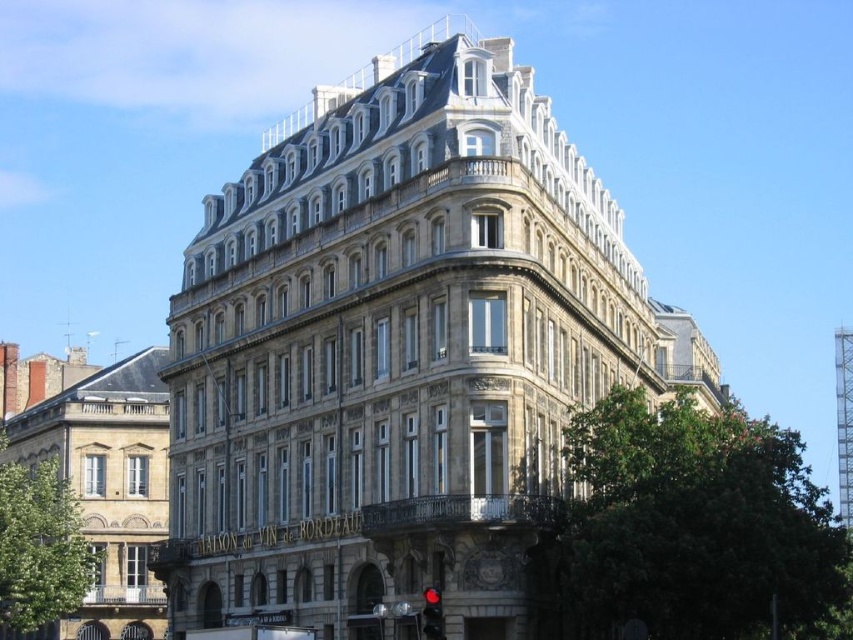
Question: Is stone building at center closer to camera compared to matte beige building at left?

Choices:
 (A) no
 (B) yes

Answer: (B)

Question: Which of the following is the farthest from the observer?

Choices:
 (A) red glass traffic light at lower center
 (B) stone building at center
 (C) matte beige building at left

Answer: (C)

Question: Which object is positioned closest to the stone building at center?

Choices:
 (A) red glass traffic light at lower center
 (B) matte beige building at left

Answer: (B)

Question: Among these points, which one is nearest to the camera?

Choices:
 (A) (248, 588)
 (B) (421, 621)
 (C) (108, 636)

Answer: (B)

Question: Is the position of matte beige building at left more distant than that of red glass traffic light at lower center?

Choices:
 (A) no
 (B) yes

Answer: (B)

Question: Can you confirm if stone building at center is thinner than matte beige building at left?

Choices:
 (A) no
 (B) yes

Answer: (A)